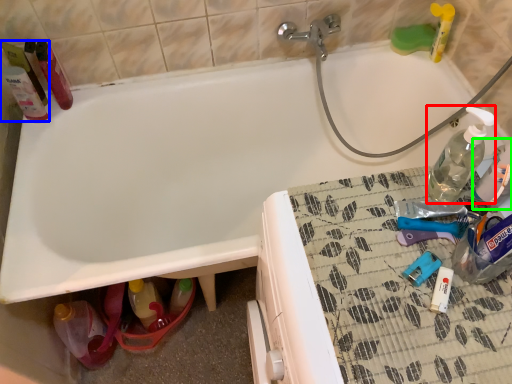
Question: Which object is the closest to the bottle (highlighted by a red box)? Choose among these: cleaning product (highlighted by a blue box) or bottle (highlighted by a green box).

Choices:
 (A) cleaning product
 (B) bottle

Answer: (B)